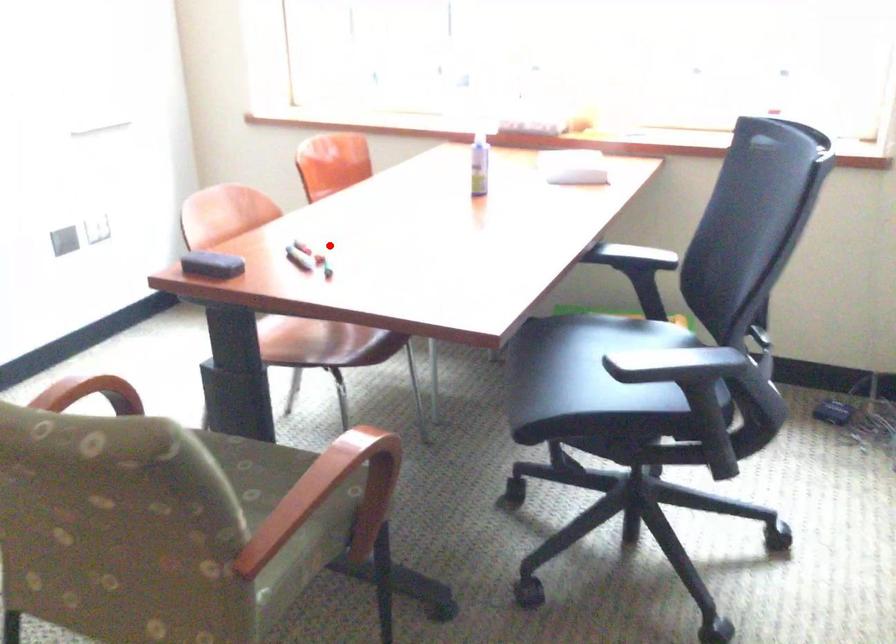
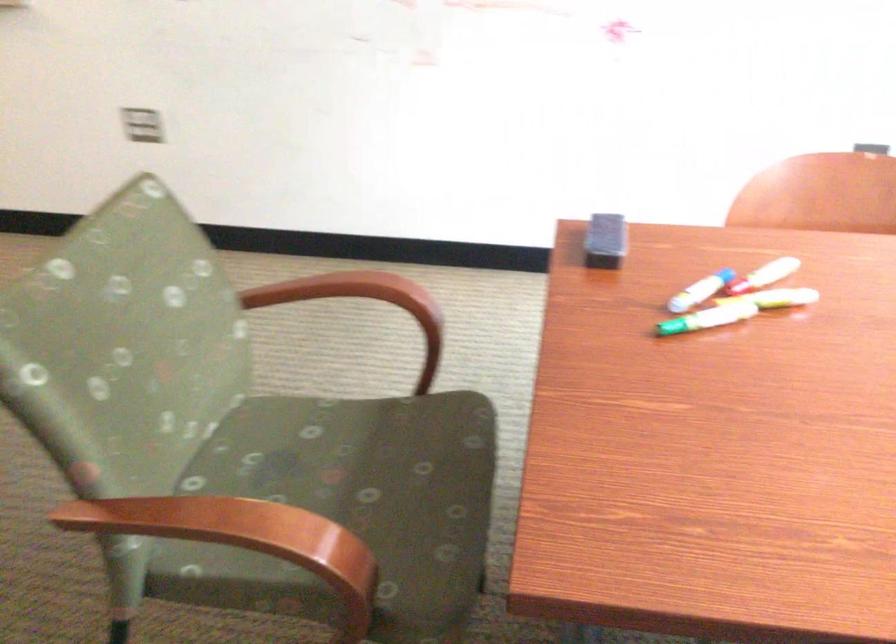
Question: A red point is marked in image1. In image2, is the corresponding 3D point closer to the camera or farther? Reply with the corresponding letter.

Choices:
 (A) The corresponding 3D point is closer.
 (B) The corresponding 3D point is farther.

Answer: (A)